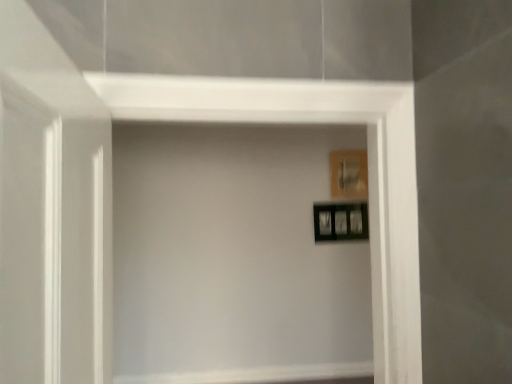
Question: Is transparent glass door at left positioned beyond the bounds of wooden picture frame at upper right, which is the 1th picture frame in top-to-bottom order?

Choices:
 (A) no
 (B) yes

Answer: (B)

Question: Does transparent glass door at left have a smaller size compared to wooden picture frame at upper right, the 2th picture frame positioned from the bottom?

Choices:
 (A) no
 (B) yes

Answer: (A)

Question: Is transparent glass door at left aimed at wooden picture frame at upper right, the 2th picture frame positioned from the bottom?

Choices:
 (A) yes
 (B) no

Answer: (B)

Question: From a real-world perspective, is transparent glass door at left physically above wooden picture frame at upper right, the 2th picture frame positioned from the bottom?

Choices:
 (A) yes
 (B) no

Answer: (B)

Question: Is transparent glass door at left bigger than wooden picture frame at upper right, which is the 1th picture frame in top-to-bottom order?

Choices:
 (A) no
 (B) yes

Answer: (B)

Question: Based on their sizes in the image, would you say wooden picture frame at upper right, the 2th picture frame positioned from the bottom, is bigger or smaller than black glossy picture frame at upper right, which appears as the 1th picture frame when ordered from the bottom?

Choices:
 (A) big
 (B) small

Answer: (B)

Question: From the image's perspective, is wooden picture frame at upper right, which is the 1th picture frame in top-to-bottom order, positioned above or below black glossy picture frame at upper right, which appears as the 1th picture frame when ordered from the bottom?

Choices:
 (A) below
 (B) above

Answer: (B)

Question: Considering the relative positions of wooden picture frame at upper right, the 2th picture frame positioned from the bottom, and black glossy picture frame at upper right, which appears as the 1th picture frame when ordered from the bottom, in the image provided, is wooden picture frame at upper right, the 2th picture frame positioned from the bottom, to the left or to the right of black glossy picture frame at upper right, which appears as the 1th picture frame when ordered from the bottom,?

Choices:
 (A) right
 (B) left

Answer: (A)

Question: Considering the positions of wooden picture frame at upper right, which is the 1th picture frame in top-to-bottom order, and black glossy picture frame at upper right, which appears as the 1th picture frame when ordered from the bottom, in the image, is wooden picture frame at upper right, which is the 1th picture frame in top-to-bottom order, taller or shorter than black glossy picture frame at upper right, which appears as the 1th picture frame when ordered from the bottom,?

Choices:
 (A) tall
 (B) short

Answer: (A)

Question: Is black glossy picture frame at upper right, the 2th picture frame from the top, situated inside wooden picture frame at upper right, the 2th picture frame positioned from the bottom, or outside?

Choices:
 (A) inside
 (B) outside

Answer: (B)

Question: Is black glossy picture frame at upper right, which appears as the 1th picture frame when ordered from the bottom, bigger or smaller than wooden picture frame at upper right, which is the 1th picture frame in top-to-bottom order?

Choices:
 (A) small
 (B) big

Answer: (B)

Question: In the image, is black glossy picture frame at upper right, which appears as the 1th picture frame when ordered from the bottom, positioned in front of or behind wooden picture frame at upper right, which is the 1th picture frame in top-to-bottom order?

Choices:
 (A) behind
 (B) front

Answer: (B)

Question: Considering the positions of point tap(344, 205) and point tap(334, 190), is point tap(344, 205) closer or farther from the camera than point tap(334, 190)?

Choices:
 (A) farther
 (B) closer

Answer: (A)

Question: In the image, is transparent glass door at left positioned in front of or behind black glossy picture frame at upper right, the 2th picture frame from the top?

Choices:
 (A) behind
 (B) front

Answer: (B)

Question: From a real-world perspective, is transparent glass door at left physically located above or below black glossy picture frame at upper right, which appears as the 1th picture frame when ordered from the bottom?

Choices:
 (A) above
 (B) below

Answer: (B)